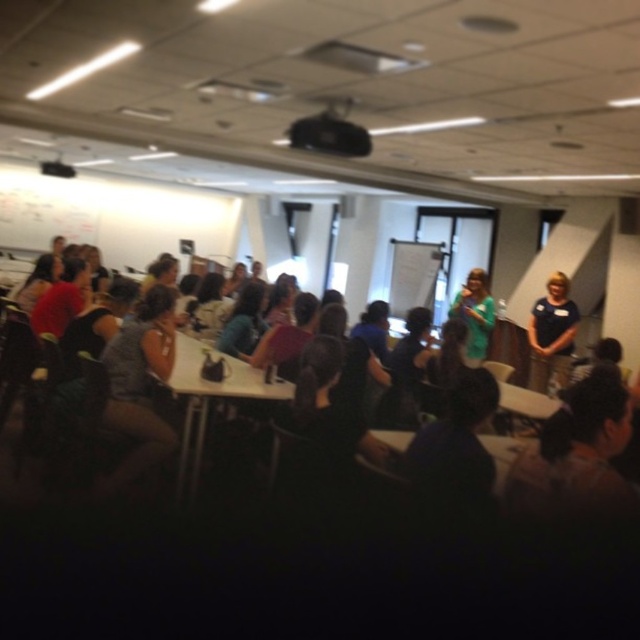
You are standing at point (436, 246) in the conference room. The nearest exit is 31.93 feet away. Can you safely walk to the exit without needing to move any furniture?

The distance between you and the nearest exit is 31.93 feet. Since there is no mention of furniture blocking the path in the scene description, you can likely walk to the exit safely without moving any furniture.

You are an attendee at the conference and want to take a photo of the white paperboard at center and the green fabric dress at center. Which object should you focus on first if you want to capture both in the same frame without moving the camera?

The white paperboard at center is taller than the green fabric dress at center, so you should focus on the white paperboard at center first to ensure it fits within the frame.

Based on the photo, you are trying to locate the matte black table at center in the conference room. According to the coordinates provided, where exactly is it positioned?

The matte black table at center is located at coordinates point (209, 401).